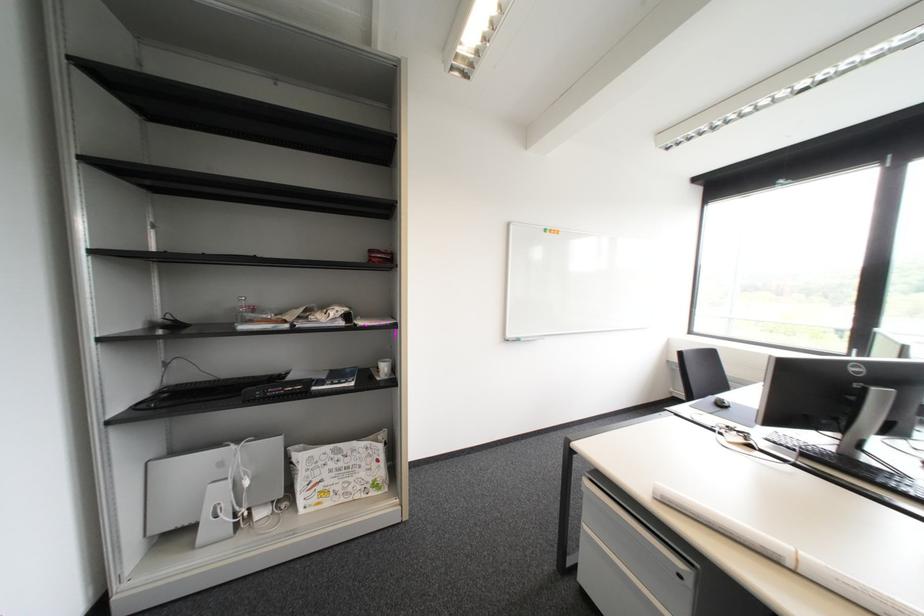
The location [721,403] corresponds to which object?

This point indicates the black computer mouse.